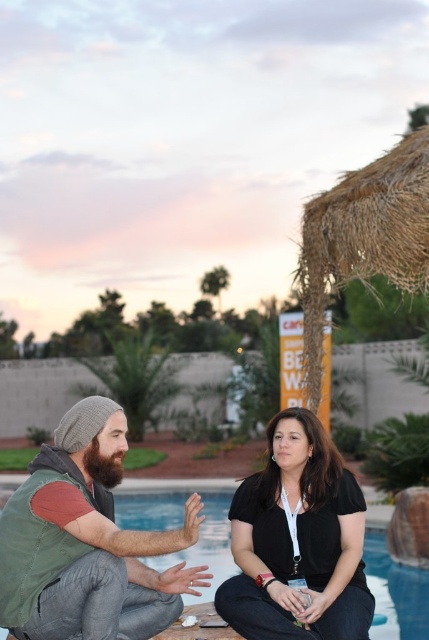
Question: Which point appears farthest from the camera in this image?

Choices:
 (A) (84, 538)
 (B) (265, 516)

Answer: (B)

Question: Which object is positioned farthest from the blue smooth water at center?

Choices:
 (A) green textured vest at center
 (B) black matte shirt at center

Answer: (A)

Question: Can you confirm if black matte shirt at center is wider than blue smooth water at center?

Choices:
 (A) no
 (B) yes

Answer: (A)

Question: Considering the relative positions of green textured vest at center and blue smooth water at center in the image provided, where is green textured vest at center located with respect to blue smooth water at center?

Choices:
 (A) left
 (B) right

Answer: (B)

Question: Which point is farther from the camera taking this photo?

Choices:
 (A) (132, 580)
 (B) (326, 592)
 (C) (223, 541)

Answer: (C)

Question: Does green textured vest at center appear under black matte shirt at center?

Choices:
 (A) yes
 (B) no

Answer: (B)